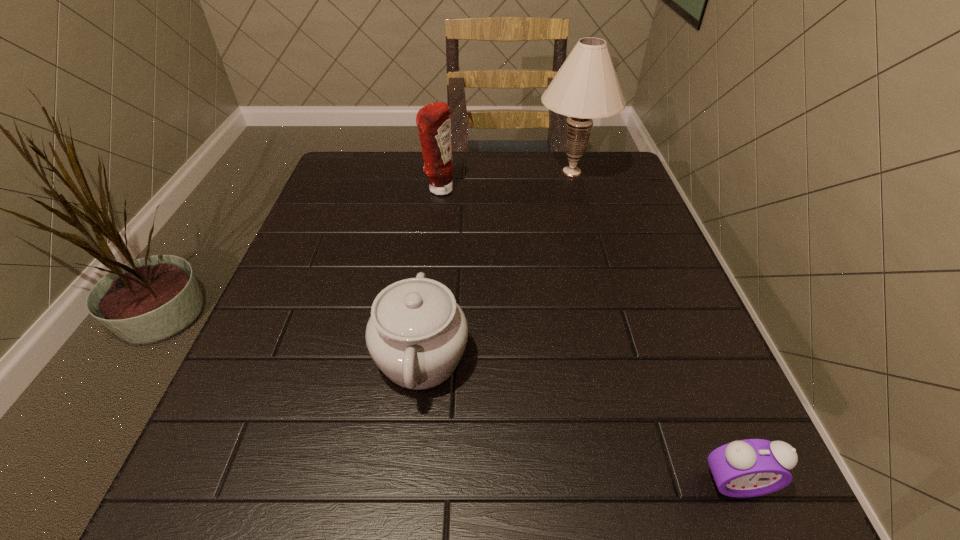
This screenshot has width=960, height=540. Identify the location of condiment that is at the far edge. (433, 120).

This screenshot has height=540, width=960. Identify the location of object present at the near edge. (752, 467).

I want to click on lampshade located in the right edge section of the desktop, so click(586, 87).

Locate an element on the screen. The width and height of the screenshot is (960, 540). alarm clock that is at the right edge is located at coordinates (752, 467).

Find the location of a particular element. object that is positioned at the far right corner is located at coordinates (586, 87).

The image size is (960, 540). In order to click on object positioned at the near right corner in this screenshot , I will do `click(752, 467)`.

In the image, there is a desktop. Identify the location of vacant region at the far edge. (534, 166).

Where is `vacant space at the near edge of the desktop`? The height and width of the screenshot is (540, 960). vacant space at the near edge of the desktop is located at coordinates (477, 502).

At what (x,y) coordinates should I click in order to perform the action: click on vacant space at the left edge. Please return your answer as a coordinate pair (x, y). The image size is (960, 540). Looking at the image, I should click on (372, 203).

You are a GUI agent. You are given a task and a screenshot of the screen. Output one action in this format:
    pyautogui.click(x=<x>, y=<y>)
    Task: Click on the vacant region at the right edge of the desktop
    Image resolution: width=960 pixels, height=540 pixels.
    Given the screenshot: What is the action you would take?
    pyautogui.click(x=711, y=422)